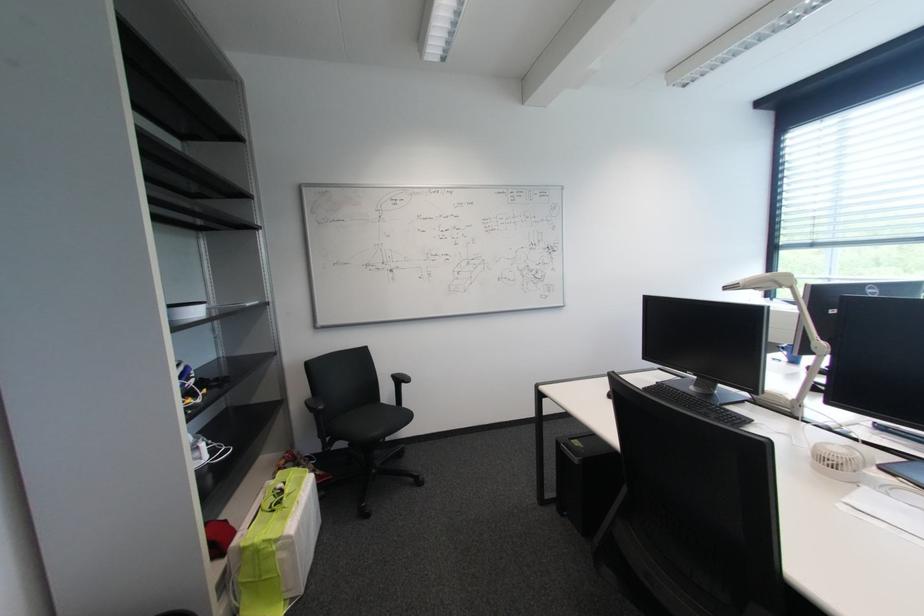
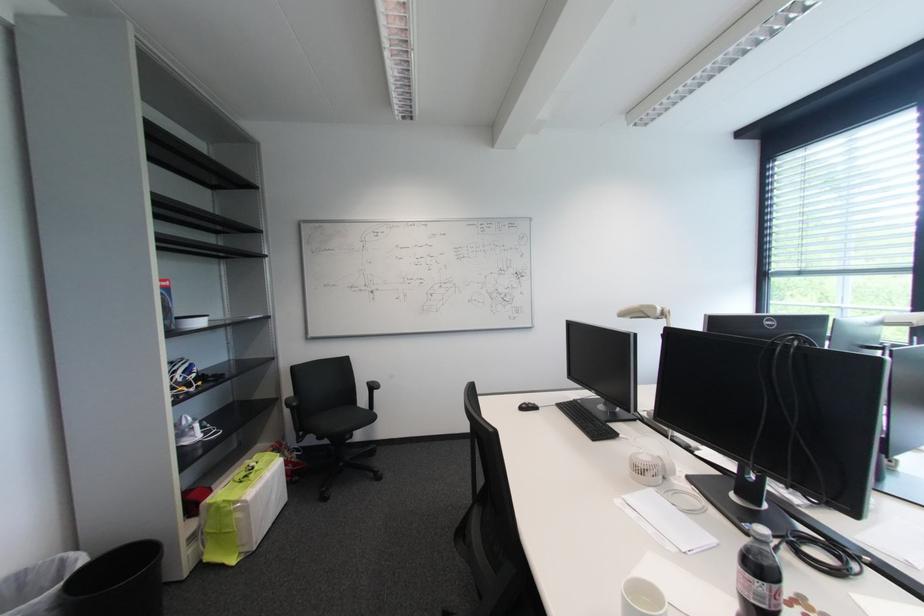
Question: The camera is either moving clockwise (left) or counter-clockwise (right) around the object. The first image is from the beginning of the video and the second image is from the end. Is the camera moving left or right when shooting the video?

Choices:
 (A) Left
 (B) Right

Answer: (B)